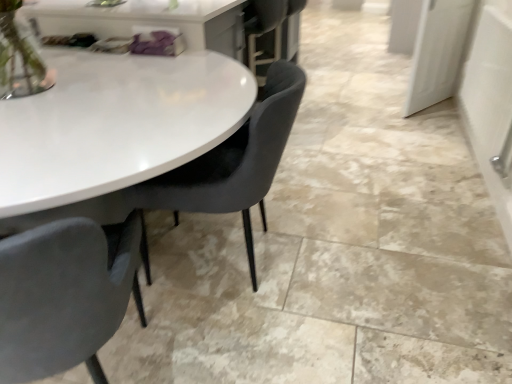
Question: Is velvet grey chair at center, which is the 2th chair from right to left, facing away from white glossy door at upper right?

Choices:
 (A) yes
 (B) no

Answer: (B)

Question: From the image's perspective, is velvet grey chair at center, the first chair when ordered from left to right, below white glossy door at upper right?

Choices:
 (A) no
 (B) yes

Answer: (B)

Question: Does velvet grey chair at center, which is the 2th chair from right to left, have a greater width compared to white glossy door at upper right?

Choices:
 (A) yes
 (B) no

Answer: (A)

Question: Considering the relative positions of velvet grey chair at center, which is the 2th chair from right to left, and white glossy door at upper right in the image provided, is velvet grey chair at center, which is the 2th chair from right to left, to the left of white glossy door at upper right from the viewer's perspective?

Choices:
 (A) no
 (B) yes

Answer: (B)

Question: Is white glossy door at upper right inside velvet grey chair at center, which is the 2th chair from right to left?

Choices:
 (A) yes
 (B) no

Answer: (B)

Question: Does velvet grey chair at center, the first chair when ordered from left to right, turn towards white glossy door at upper right?

Choices:
 (A) no
 (B) yes

Answer: (A)

Question: Considering the relative sizes of white glossy door at upper right and velvet grey chair at center, which is the 2th chair from right to left, in the image provided, is white glossy door at upper right bigger than velvet grey chair at center, which is the 2th chair from right to left,?

Choices:
 (A) no
 (B) yes

Answer: (A)

Question: Is the position of white glossy door at upper right more distant than that of velvet grey chair at center, which is the 2th chair from right to left?

Choices:
 (A) no
 (B) yes

Answer: (B)

Question: From a real-world perspective, is white glossy door at upper right beneath velvet grey chair at center, which is the 2th chair from right to left?

Choices:
 (A) no
 (B) yes

Answer: (A)

Question: Does white glossy door at upper right turn towards velvet grey chair at center, which is the 2th chair from right to left?

Choices:
 (A) no
 (B) yes

Answer: (A)

Question: Considering the relative sizes of white glossy door at upper right and velvet grey chair at center, the first chair when ordered from left to right, in the image provided, is white glossy door at upper right shorter than velvet grey chair at center, the first chair when ordered from left to right,?

Choices:
 (A) yes
 (B) no

Answer: (A)

Question: Is white glossy door at upper right turned away from velvet grey chair at center, the first chair when ordered from left to right?

Choices:
 (A) yes
 (B) no

Answer: (B)

Question: Is matte black chair at center, placed as the first chair when sorted from right to left, bigger than velvet grey chair at center, which is the 2th chair from right to left?

Choices:
 (A) yes
 (B) no

Answer: (B)